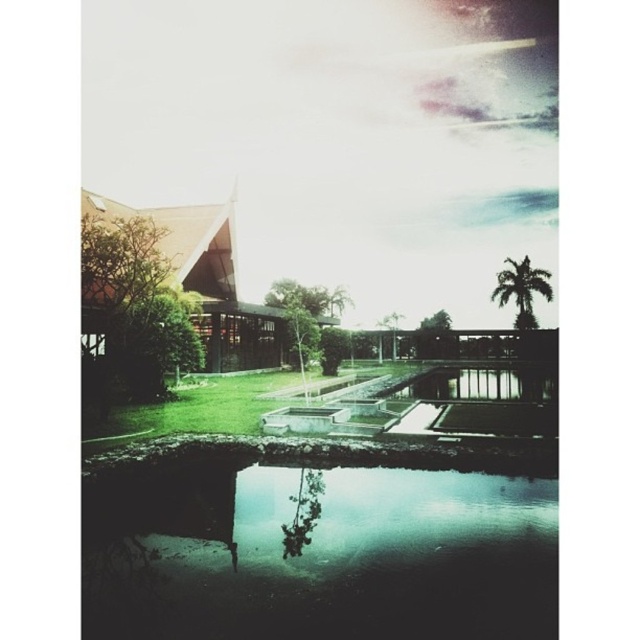
Question: Which point is closer to the camera taking this photo?

Choices:
 (A) (515, 272)
 (B) (184, 608)

Answer: (B)

Question: Does green reflective water at bottom have a lesser width compared to green leafy palm tree at upper right?

Choices:
 (A) no
 (B) yes

Answer: (A)

Question: Is the position of green reflective water at bottom less distant than that of green leafy palm tree at upper right?

Choices:
 (A) yes
 (B) no

Answer: (A)

Question: Among these points, which one is farthest from the camera?

Choices:
 (A) (540, 284)
 (B) (483, 636)

Answer: (A)

Question: Does green reflective water at bottom appear on the right side of green leafy palm tree at upper right?

Choices:
 (A) yes
 (B) no

Answer: (B)